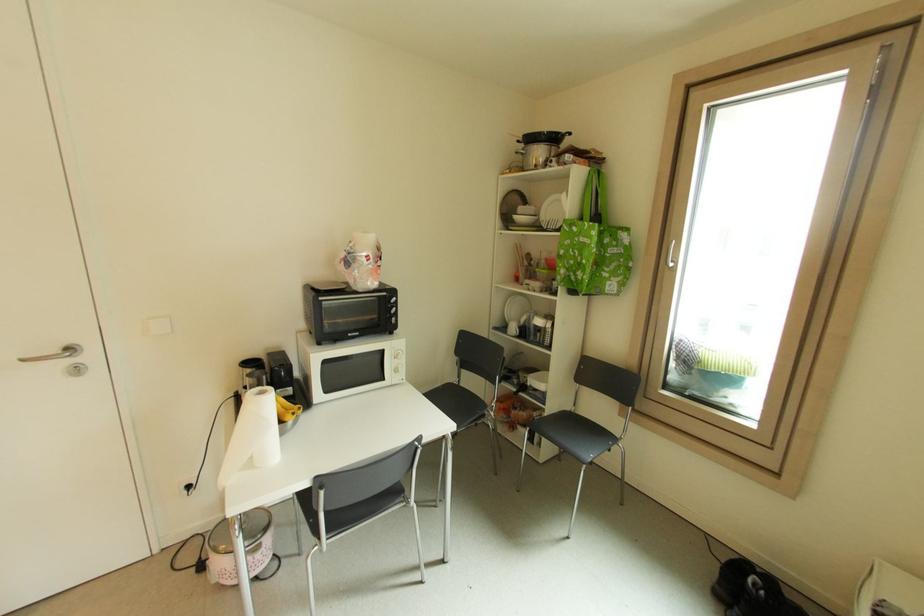
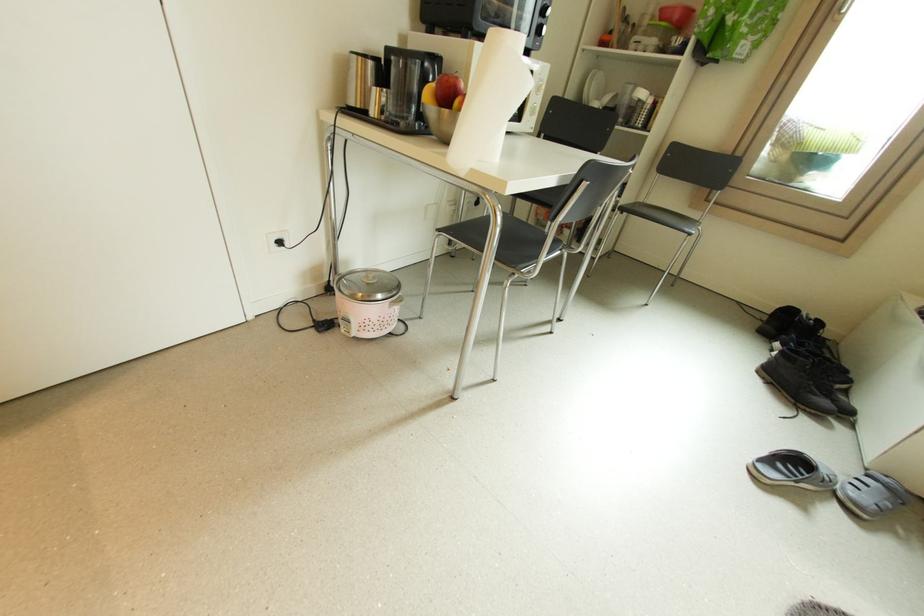
In the second image, find the point that corresponds to (x=552, y=261) in the first image.

(666, 10)